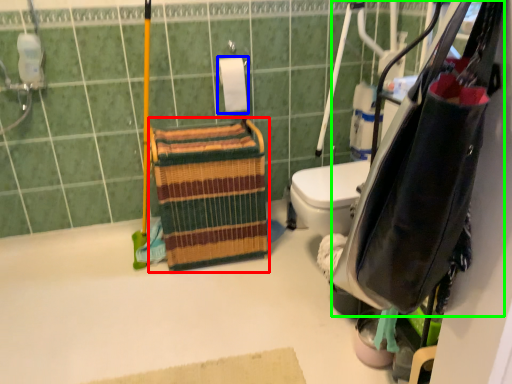
Question: Which object is the farthest from basket (highlighted by a red box)? Choose among these: toilet paper (highlighted by a blue box) or bag (highlighted by a green box).

Choices:
 (A) toilet paper
 (B) bag

Answer: (B)